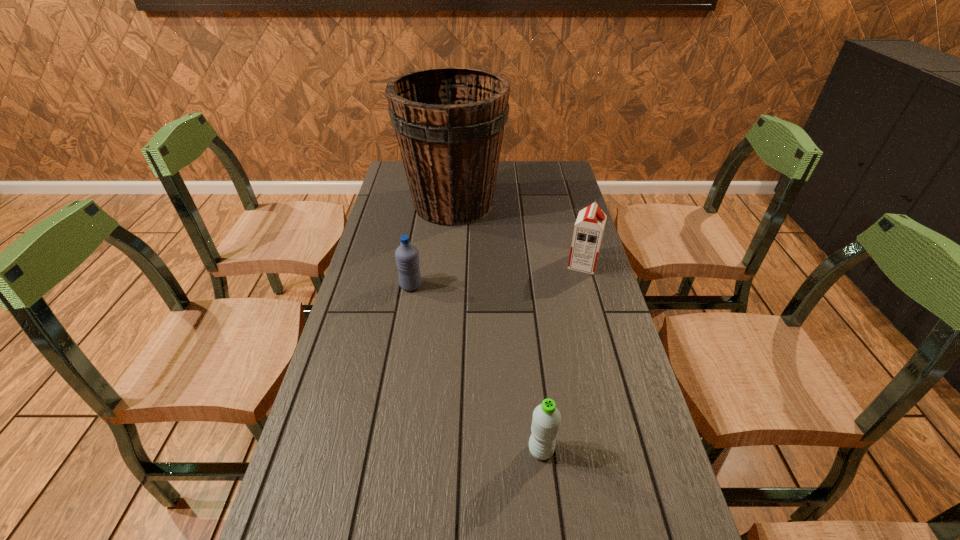
You are a GUI agent. You are given a task and a screenshot of the screen. Output one action in this format:
    pyautogui.click(x=<x>, y=<y>)
    Task: Click on the farthest object
    
    Given the screenshot: What is the action you would take?
    pyautogui.click(x=449, y=122)

Locate an element on the screen. bucket is located at coordinates (449, 122).

What are the coordinates of `the second farthest object` in the screenshot? It's located at (588, 230).

Locate an element on the screen. The width and height of the screenshot is (960, 540). the rightmost object is located at coordinates (588, 230).

At what (x,y) coordinates should I click in order to perform the action: click on the second nearest object. Please return your answer as a coordinate pair (x, y). Looking at the image, I should click on (407, 256).

Find the location of a particular element. This screenshot has width=960, height=540. the left water bottle is located at coordinates (407, 256).

Image resolution: width=960 pixels, height=540 pixels. I want to click on the third object from left to right, so click(x=546, y=419).

At what (x,y) coordinates should I click in order to perform the action: click on the nearest object. Please return your answer as a coordinate pair (x, y). Looking at the image, I should click on (546, 419).

You are a GUI agent. You are given a task and a screenshot of the screen. Output one action in this format:
    pyautogui.click(x=<x>, y=<y>)
    Task: Click on the vacant space located on the front of the bucket
    
    Given the screenshot: What is the action you would take?
    pyautogui.click(x=448, y=259)

What are the coordinates of `vacant area situated on the front of the rightmost object` in the screenshot? It's located at click(589, 288).